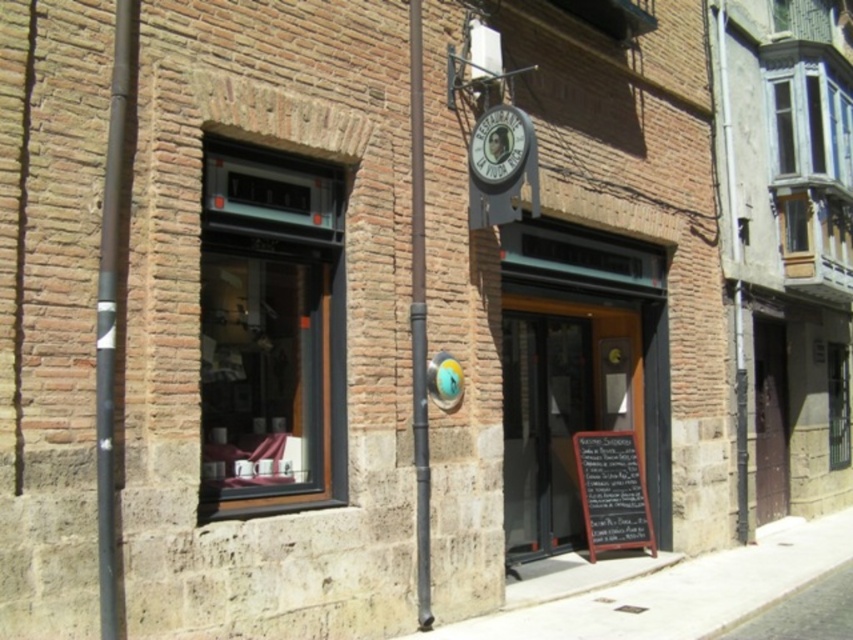
You are a customer entering the RESTAURANTE LA VIUDA RICA and want to see the menu. The black chalkboard at lower right and the clear glass window at right are both visible. Which object is shorter in height?

The black chalkboard at lower right has a lesser height compared to the clear glass window at right, so the black chalkboard at lower right is shorter in height.

You are a delivery person with a package that requires a clear path to the wooden door at center. There is a blue painted wood window at upper right nearby. Can you safely navigate to the door without passing under the window?

The distance between the wooden door at center and the blue painted wood window at upper right is 4.68 meters. Since the window is above the door, you can safely navigate to the door without passing under the window as the path is clear.

You are a delivery person trying to deliver a package to the RESTAURENTE LA VIUDA RICA. The package is too big to fit through the blue painted wood window at upper right. Can you use the wooden door at center instead?

The wooden door at center is larger in size than the blue painted wood window at upper right, so yes, the package can be delivered through the wooden door at center.